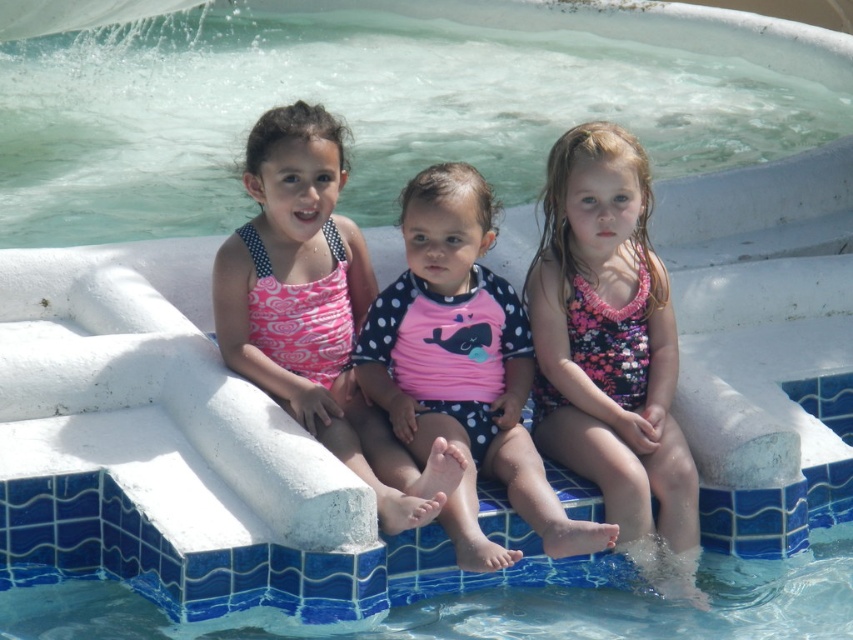
Question: Which object is farther from the camera taking this photo?

Choices:
 (A) pink polka dot swimsuit at left
 (B) pink polka dot swimsuit at center

Answer: (A)

Question: Which point is closer to the camera taking this photo?

Choices:
 (A) (560, 195)
 (B) (456, 260)
 (C) (296, 202)

Answer: (B)

Question: Is pink floral swimsuit at center behind pink polka dot swimsuit at left?

Choices:
 (A) yes
 (B) no

Answer: (A)

Question: Is pink floral swimsuit at center smaller than pink polka dot swimsuit at center?

Choices:
 (A) yes
 (B) no

Answer: (A)

Question: Does pink floral swimsuit at center appear over pink polka dot swimsuit at center?

Choices:
 (A) no
 (B) yes

Answer: (A)

Question: Which is nearer to the pink polka dot swimsuit at left?

Choices:
 (A) pink polka dot swimsuit at center
 (B) pink floral swimsuit at center

Answer: (A)